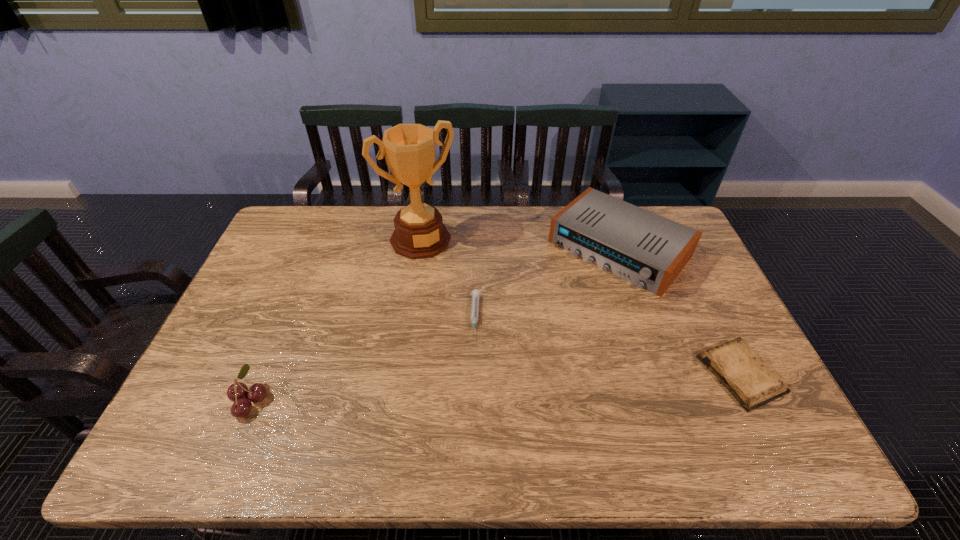
The width and height of the screenshot is (960, 540). Identify the location of unoccupied position between the radio receiver and the tallest object. pos(519,244).

In order to click on object that is the third closest to the radio receiver in this screenshot , I will do `click(409, 149)`.

Where is `object that ranks as the fourth closest to the leftmost object`? object that ranks as the fourth closest to the leftmost object is located at coordinates (737, 366).

What are the coordinates of `free region that satisfies the following two spatial constraints: 1. on the front side of the diary; 2. on the right side of the second object from left to right` in the screenshot? It's located at (400, 374).